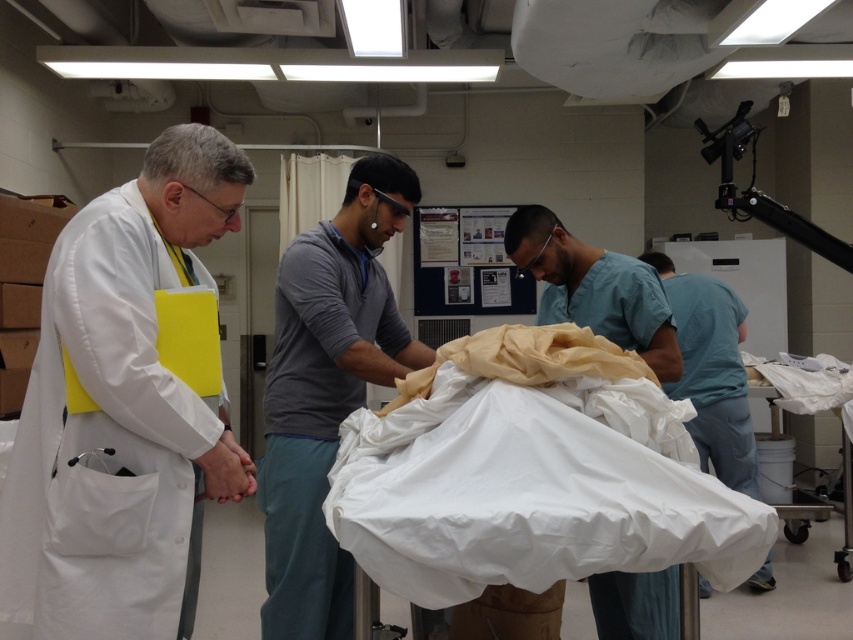
Question: Among these points, which one is farthest from the camera?

Choices:
 (A) (647, 364)
 (B) (418, 467)

Answer: (A)

Question: Which of these objects is positioned farthest from the teal scrubs at center?

Choices:
 (A) white fabric at center
 (B) blue scrubs at center
 (C) gray cotton shirt at center

Answer: (C)

Question: Is white matte lab coat at left further to camera compared to blue scrubs at center?

Choices:
 (A) yes
 (B) no

Answer: (B)

Question: Can you confirm if white matte lab coat at left is positioned to the left of gray cotton shirt at center?

Choices:
 (A) yes
 (B) no

Answer: (A)

Question: Estimate the real-world distances between objects in this image. Which object is closer to the white fabric at center?

Choices:
 (A) blue scrubs at center
 (B) white matte lab coat at left
 (C) gray cotton shirt at center
 (D) teal scrubs at center

Answer: (C)

Question: Is white matte lab coat at left closer to camera compared to gray cotton shirt at center?

Choices:
 (A) yes
 (B) no

Answer: (A)